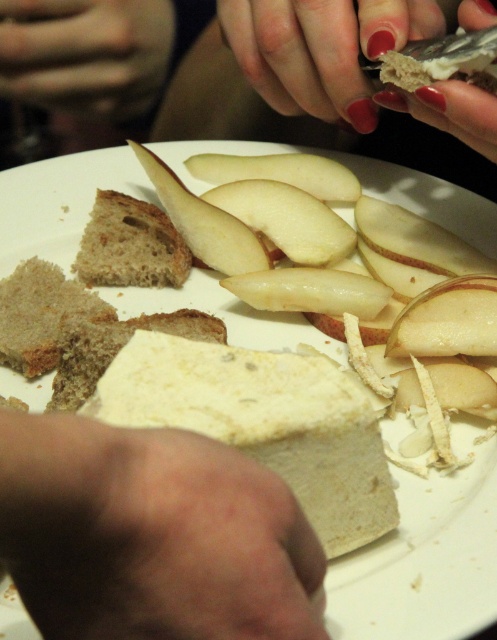
Question: Is white creamy cheese at center closer to the viewer compared to white smooth apple at center?

Choices:
 (A) yes
 (B) no

Answer: (A)

Question: Among these objects, which one is farthest from the camera?

Choices:
 (A) white smooth apple at center
 (B) smooth beige bread at center
 (C) nail polish at upper center

Answer: (A)

Question: Is brown crusty bread at left below white smooth apple at center?

Choices:
 (A) yes
 (B) no

Answer: (A)

Question: Which point is closer to the camera?

Choices:
 (A) brown crusty bread at left
 (B) white creamy cheese at center
 (C) smooth skin hand at upper center
 (D) white smooth apple at center

Answer: (B)

Question: Does smooth beige bread at center lie behind smooth skin hand at upper center?

Choices:
 (A) no
 (B) yes

Answer: (A)

Question: Which point appears closest to the camera in this image?

Choices:
 (A) (87, 230)
 (B) (15, 38)
 (C) (475, 96)

Answer: (C)